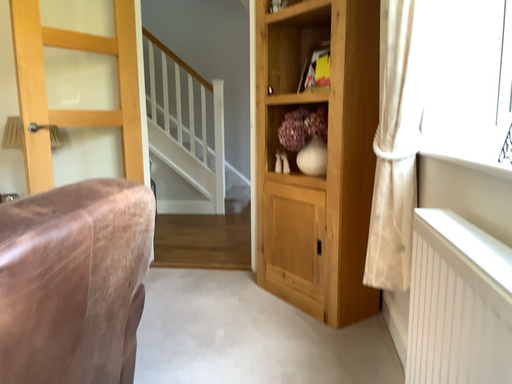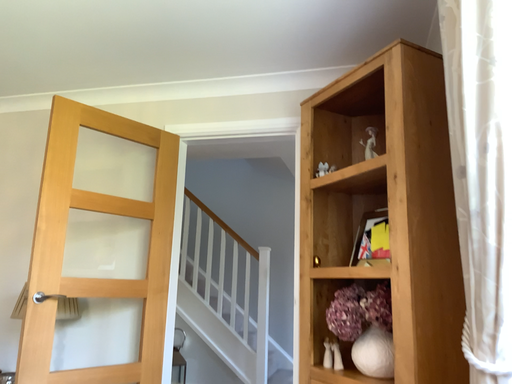
Question: How did the camera likely rotate when shooting the video?

Choices:
 (A) rotated upward
 (B) rotated downward

Answer: (A)